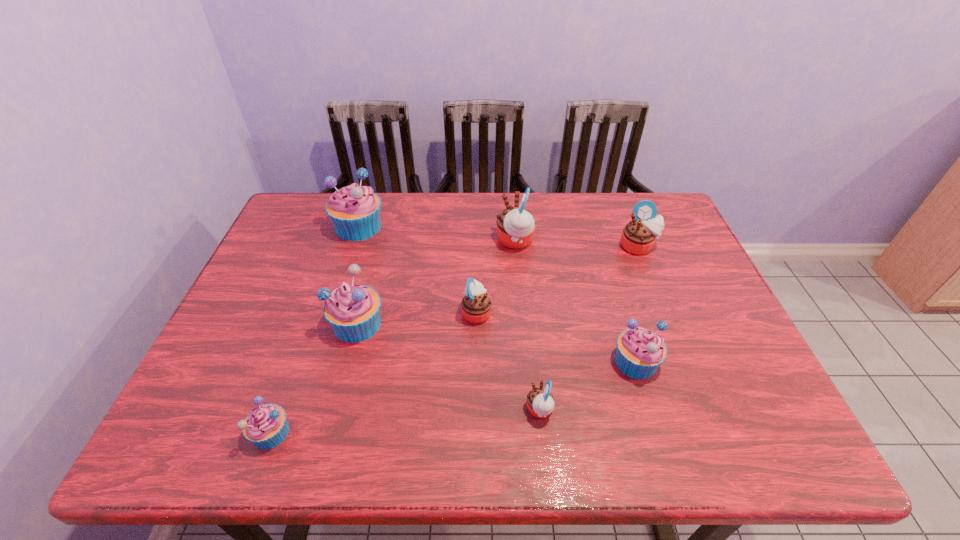
Find the location of a particular element. The image size is (960, 540). free space located on the front-facing side of the smallest pink muffin is located at coordinates (479, 410).

Where is `vacant space located on the front-facing side of the smallest pink muffin`? This screenshot has height=540, width=960. vacant space located on the front-facing side of the smallest pink muffin is located at coordinates (385, 410).

At what (x,y) coordinates should I click in order to perform the action: click on vacant space located 0.310m on the front-facing side of the smallest pink muffin. Please return your answer as a coordinate pair (x, y). The image size is (960, 540). Looking at the image, I should click on (380, 410).

Locate an element on the screen. object present at the left edge is located at coordinates click(x=266, y=427).

Image resolution: width=960 pixels, height=540 pixels. I want to click on object that is at the right edge, so click(x=638, y=237).

Locate an element on the screen. This screenshot has height=540, width=960. object that is at the near left corner is located at coordinates (266, 427).

Where is `object present at the far right corner`? The image size is (960, 540). object present at the far right corner is located at coordinates (638, 237).

Where is `vacant space at the far edge of the desktop`? This screenshot has width=960, height=540. vacant space at the far edge of the desktop is located at coordinates (400, 202).

In the image, there is a desktop. At what (x,y) coordinates should I click in order to perform the action: click on vacant region at the near edge. Please return your answer as a coordinate pair (x, y). The width and height of the screenshot is (960, 540). Looking at the image, I should click on (564, 436).

In the image, there is a desktop. At what (x,y) coordinates should I click in order to perform the action: click on vacant space at the left edge. Please return your answer as a coordinate pair (x, y). The height and width of the screenshot is (540, 960). Looking at the image, I should click on (188, 399).